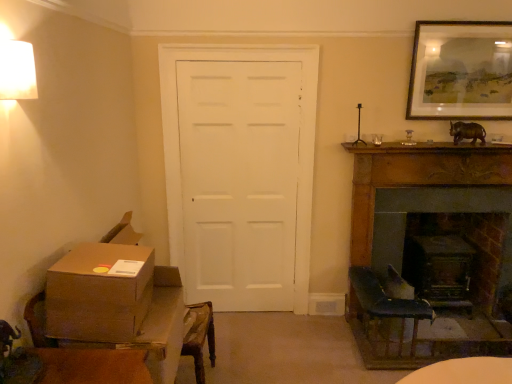
Locate an element on the screen. The width and height of the screenshot is (512, 384). vacant space situated above dark wood fireplace at right, the 2th fireplace from the back (from a real-world perspective) is located at coordinates (442, 156).